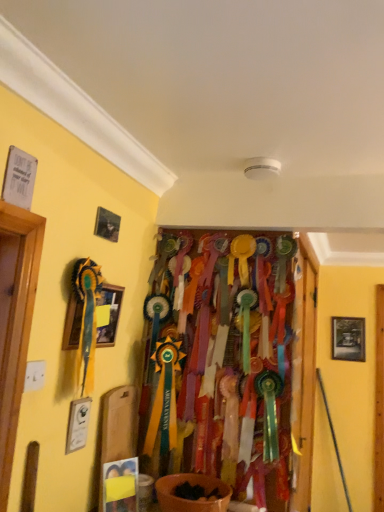
Question: Is wooden framed picture at right, marked as the 1th picture frame in a bottom-to-top arrangement, beside wooden framed picture at left, the 1th picture frame in the top-to-bottom sequence?

Choices:
 (A) no
 (B) yes

Answer: (A)

Question: From the image's perspective, is wooden framed picture at right, which is the second picture frame in front-to-back order, located beneath wooden framed picture at left, the 1th picture frame in the top-to-bottom sequence?

Choices:
 (A) no
 (B) yes

Answer: (B)

Question: Is wooden framed picture at right, marked as the 1th picture frame in a bottom-to-top arrangement, not within wooden framed picture at left, arranged as the second picture frame when viewed from the back?

Choices:
 (A) yes
 (B) no

Answer: (A)

Question: Is wooden framed picture at right, the second picture frame positioned from the top, wider than wooden framed picture at left, arranged as the second picture frame when viewed from the back?

Choices:
 (A) yes
 (B) no

Answer: (B)

Question: Is wooden framed picture at right, marked as the 1th picture frame in a bottom-to-top arrangement, bigger than wooden framed picture at left, the second picture frame from the right?

Choices:
 (A) no
 (B) yes

Answer: (A)

Question: Is wooden framed picture at right, the second picture frame positioned from the left, taller than wooden framed picture at left, the second picture frame from the right?

Choices:
 (A) yes
 (B) no

Answer: (A)

Question: Is wooden framed picture at right, the first picture frame from the back, wider than wooden door at center?

Choices:
 (A) no
 (B) yes

Answer: (A)

Question: Can you confirm if wooden framed picture at right, which is counted as the first picture frame, starting from the right, is smaller than wooden door at center?

Choices:
 (A) yes
 (B) no

Answer: (A)

Question: Is wooden framed picture at right, the first picture frame from the back, turned away from wooden door at center?

Choices:
 (A) no
 (B) yes

Answer: (A)

Question: Considering the relative sizes of wooden framed picture at right, marked as the 1th picture frame in a bottom-to-top arrangement, and wooden door at center in the image provided, is wooden framed picture at right, marked as the 1th picture frame in a bottom-to-top arrangement, taller than wooden door at center?

Choices:
 (A) no
 (B) yes

Answer: (A)

Question: Does wooden framed picture at right, marked as the 1th picture frame in a bottom-to-top arrangement, have a lesser height compared to wooden door at center?

Choices:
 (A) no
 (B) yes

Answer: (B)

Question: Can you confirm if wooden framed picture at right, the first picture frame from the back, is positioned to the left of wooden door at center?

Choices:
 (A) no
 (B) yes

Answer: (A)

Question: Is wooden framed picture at left, the second picture frame from the right, at the left side of wooden door at center?

Choices:
 (A) no
 (B) yes

Answer: (B)